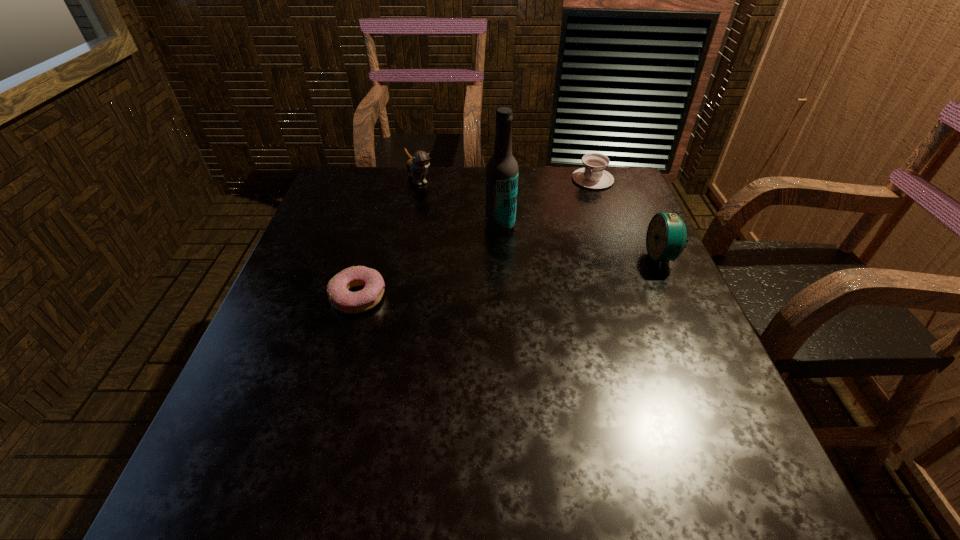
Locate an element on the screen. Image resolution: width=960 pixels, height=540 pixels. the nearest object is located at coordinates (343, 300).

Locate an element on the screen. Image resolution: width=960 pixels, height=540 pixels. doughnut is located at coordinates (343, 300).

The height and width of the screenshot is (540, 960). Identify the location of the rightmost object. (666, 235).

Identify the location of the fourth farthest object. (666, 235).

Where is `the tallest object`? the tallest object is located at coordinates (502, 170).

I want to click on the third nearest object, so (502, 170).

Locate an element on the screen. The height and width of the screenshot is (540, 960). kitten is located at coordinates (417, 165).

Locate an element on the screen. The height and width of the screenshot is (540, 960). the fourth tallest object is located at coordinates (593, 176).

At what (x,y) coordinates should I click in order to perform the action: click on the fourth object from left to right. Please return your answer as a coordinate pair (x, y). This screenshot has width=960, height=540. Looking at the image, I should click on (x=593, y=176).

Find the location of a particular element. The width and height of the screenshot is (960, 540). free space located on the front of the shortest object is located at coordinates (328, 401).